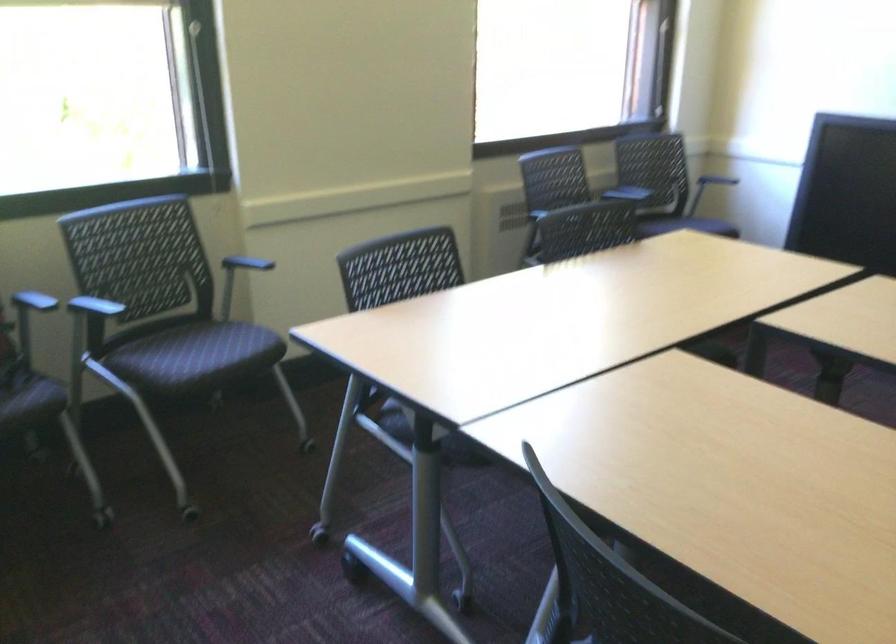
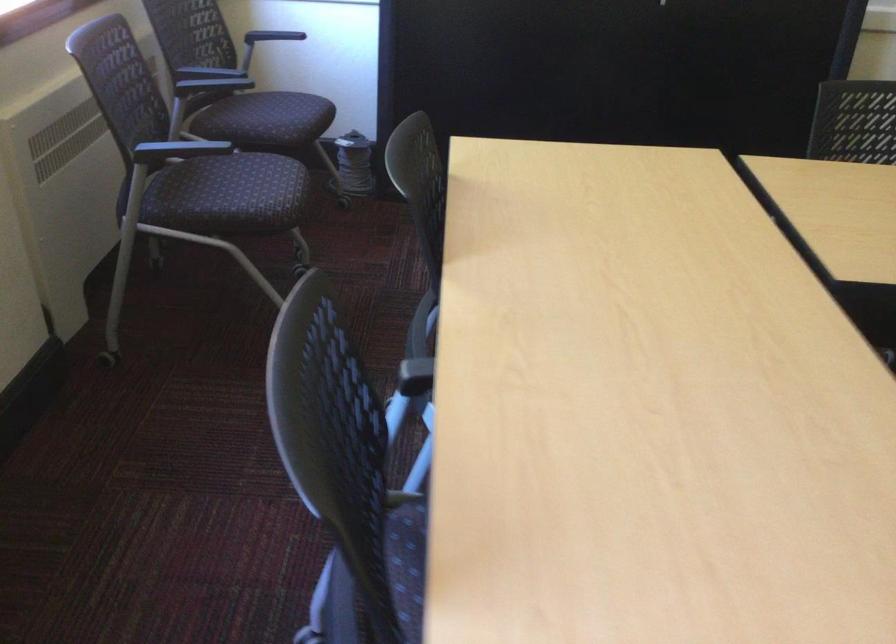
Find the pixel in the second image that matches [726,180] in the first image.

(270, 38)